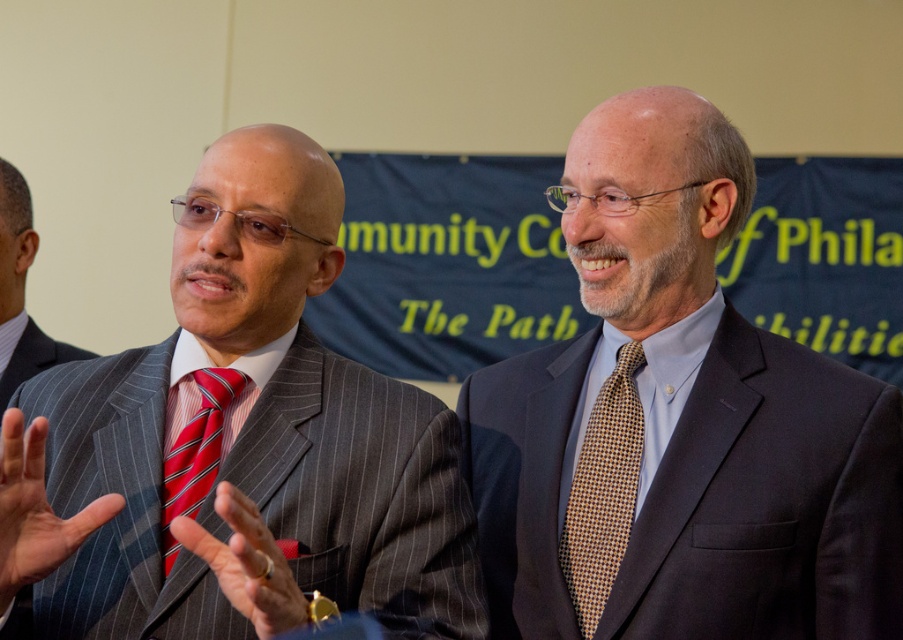
Question: Among these points, which one is farthest from the camera?

Choices:
 (A) (26, 364)
 (B) (298, 465)
 (C) (683, 173)
 (D) (638, 352)

Answer: (A)

Question: Which object is the closest to the pinstriped suit at left?

Choices:
 (A) red striped tie at left
 (B) gray pinstripe suit at center
 (C) dark blue suit at center
 (D) brown checkered tie at right

Answer: (B)

Question: Does skinny red tie at left have a lesser width compared to matte silver ring at center?

Choices:
 (A) yes
 (B) no

Answer: (B)

Question: Which object is the farthest from the dark blue suit at center?

Choices:
 (A) skinny red tie at left
 (B) pinstriped suit at left
 (C) brown checkered tie at right
 (D) gray pinstripe suit at center

Answer: (B)

Question: Does brown checkered tie at right have a smaller size compared to red striped tie at left?

Choices:
 (A) yes
 (B) no

Answer: (B)

Question: Is dark blue suit at center thinner than pinstriped suit at left?

Choices:
 (A) no
 (B) yes

Answer: (A)